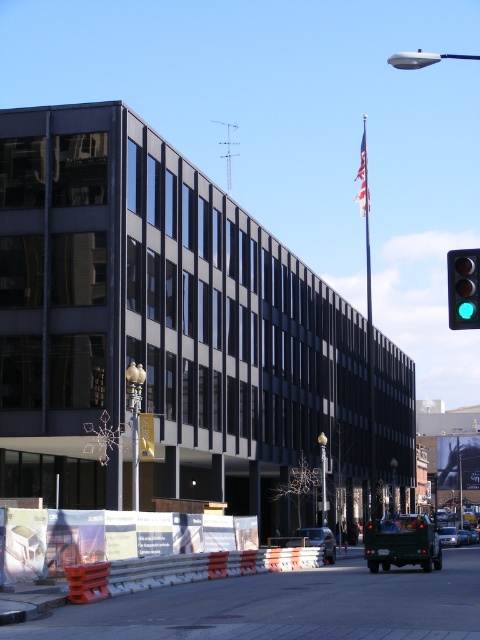
Question: Which point is farther to the camera?

Choices:
 (A) orange plastic barrier at lower center
 (B) silver metallic sedan at center
 (C) green glass traffic light at right

Answer: (B)

Question: Does orange plastic barrier at lower center appear under silver metallic sedan at center?

Choices:
 (A) no
 (B) yes

Answer: (A)

Question: Estimate the real-world distances between objects in this image. Which object is closer to the shiny silver sedan at center?

Choices:
 (A) orange plastic barrier at lower center
 (B) silver metallic sedan at center

Answer: (A)

Question: Which object is closer to the camera taking this photo?

Choices:
 (A) silver metallic sedan at center
 (B) orange plastic barrier at lower center

Answer: (B)

Question: From the image, what is the correct spatial relationship of orange plastic barrier at lower center in relation to green glass traffic light at right?

Choices:
 (A) right
 (B) left

Answer: (B)

Question: Is orange plastic barrier at lower center below green glass traffic light at right?

Choices:
 (A) no
 (B) yes

Answer: (B)